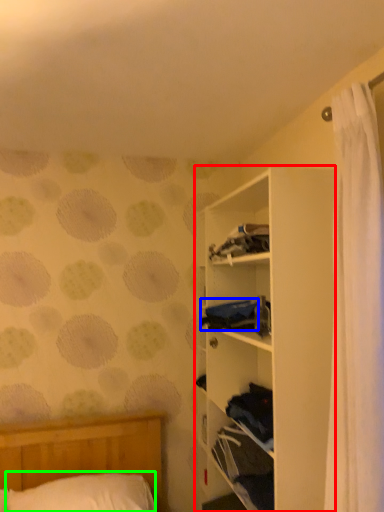
Question: Which object is positioned farthest from shelf (highlighted by a red box)? Select from clothing (highlighted by a blue box) and pillow (highlighted by a green box).

Choices:
 (A) clothing
 (B) pillow

Answer: (B)